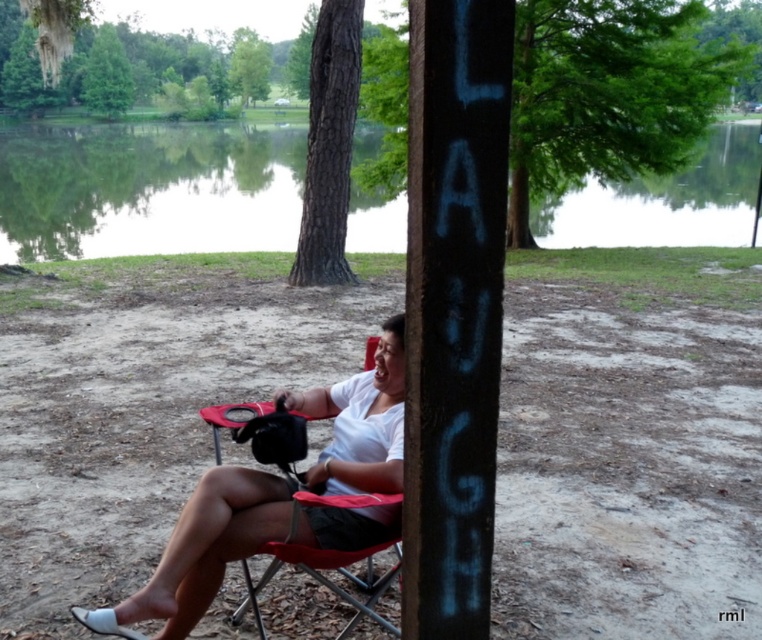
Question: Can you confirm if green reflective water at upper center is positioned below green leafy tree at upper center?

Choices:
 (A) yes
 (B) no

Answer: (A)

Question: Is white matte shirt at center wider than dark brown bark tree at upper center?

Choices:
 (A) yes
 (B) no

Answer: (A)

Question: Which is nearer to the white matte shirt at center?

Choices:
 (A) black painted wood post at center
 (B) dark brown bark tree at upper center
 (C) green reflective water at upper center
 (D) green leafy tree at upper center

Answer: (A)

Question: Can you confirm if white matte shirt at center is positioned to the right of dark brown bark tree at upper center?

Choices:
 (A) yes
 (B) no

Answer: (A)

Question: Which object appears closest to the camera in this image?

Choices:
 (A) black painted wood post at center
 (B) green reflective water at upper center
 (C) green leafy tree at upper center
 (D) dark brown bark tree at upper center

Answer: (A)

Question: Among these points, which one is nearest to the camera?

Choices:
 (A) (87, 83)
 (B) (343, 211)

Answer: (B)